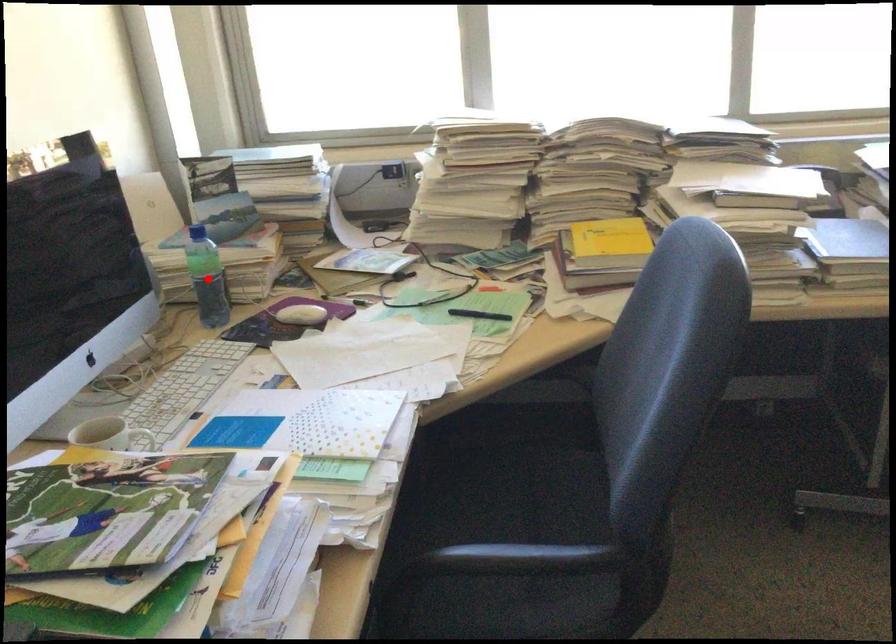
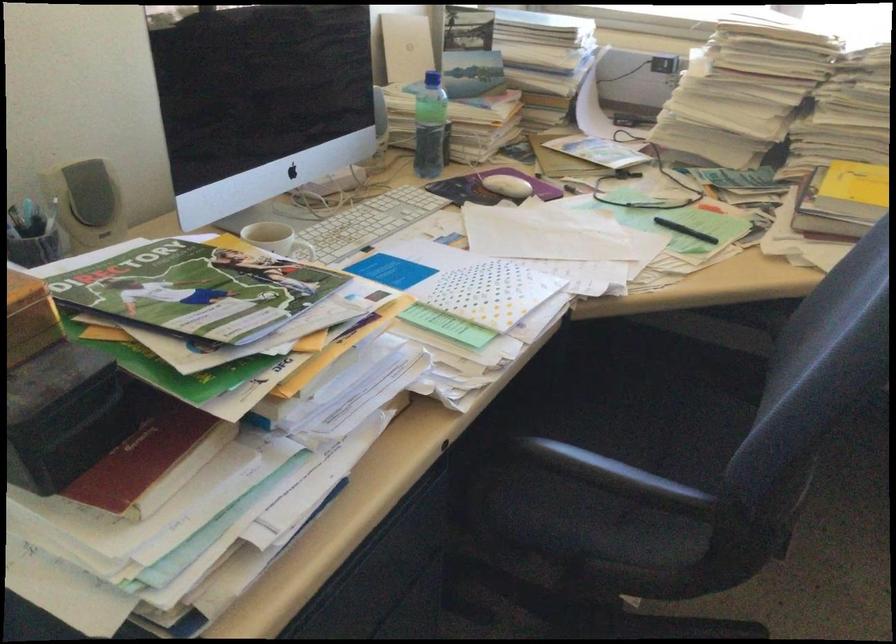
The point at the highlighted location is marked in the first image. Where is the corresponding point in the second image?

(428, 126)